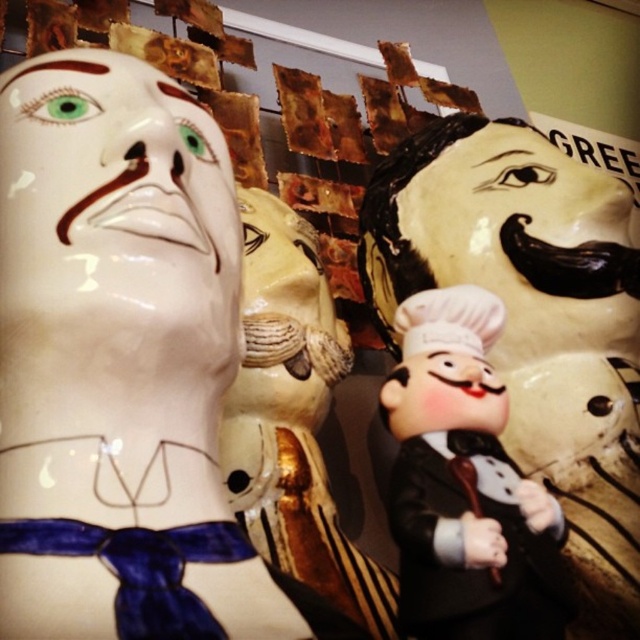
You are organizing a display and need to place the matte black chef figurine at center and the matte plastic chef at center side by side. Given their widths, which one should be placed on the left to ensure they fit within a 1.2 meter wide shelf?

The matte black chef figurine at center is wider than the matte plastic chef at center. To fit them side by side on a 1.2 meter wide shelf, place the wider matte black chef figurine at center on the left and the narrower matte plastic chef at center on the right.

You are a delivery person who needs to place a new 8 inch wide package between the white glossy mask at upper left and the matte plastic chef at center. Can the package fit in the space between them?

The distance between the white glossy mask at upper left and the matte plastic chef at center is 7.85 inches. Since the package is 8 inches wide, it will not fit in the space between them.